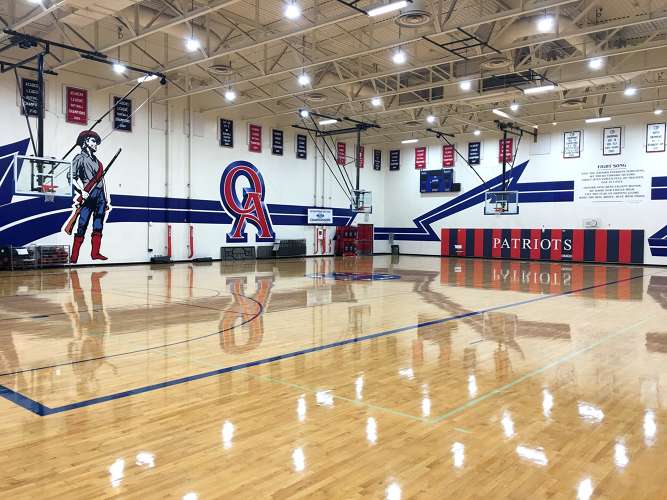
Locate an element on the screen. The height and width of the screenshot is (500, 667). mural of man in western clothes and gun is located at coordinates (105, 202).